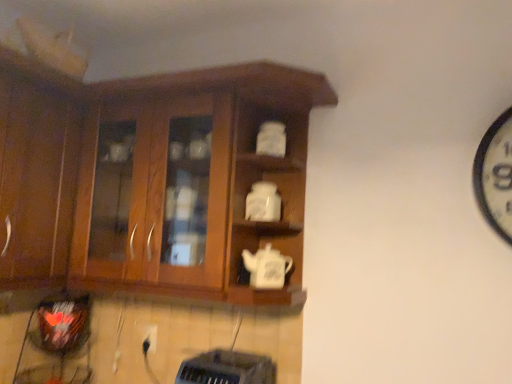
Question: Is white plastic electric outlet at lower center beside white matte teapot at center, the 2th teapot when ordered from top to bottom?

Choices:
 (A) no
 (B) yes

Answer: (A)

Question: From a real-world perspective, is white plastic electric outlet at lower center physically above white matte teapot at center, the 2th teapot when ordered from top to bottom?

Choices:
 (A) no
 (B) yes

Answer: (A)

Question: From the image's perspective, is white plastic electric outlet at lower center beneath white matte teapot at center, the 2th teapot when ordered from top to bottom?

Choices:
 (A) no
 (B) yes

Answer: (B)

Question: Does white plastic electric outlet at lower center come behind white matte teapot at center, the 1th teapot from the bottom?

Choices:
 (A) no
 (B) yes

Answer: (B)

Question: Is white plastic electric outlet at lower center oriented towards white matte teapot at center, the 1th teapot from the bottom?

Choices:
 (A) yes
 (B) no

Answer: (B)

Question: From the image's perspective, is white plastic electric outlet at lower center located above white matte teapot at center, the 1th teapot from the bottom?

Choices:
 (A) no
 (B) yes

Answer: (A)

Question: Are wooden cabinet at left, arranged as the second cabinetry when viewed from the right, and white matte teapot at center, placed as the 1th teapot when sorted from top to bottom, far apart?

Choices:
 (A) yes
 (B) no

Answer: (B)

Question: Is the depth of wooden cabinet at left, which appears as the first cabinetry when viewed from the left, less than that of white matte teapot at center, the 2th teapot ordered from the bottom?

Choices:
 (A) yes
 (B) no

Answer: (A)

Question: Is wooden cabinet at left, which appears as the first cabinetry when viewed from the left, positioned with its back to white matte teapot at center, placed as the 1th teapot when sorted from top to bottom?

Choices:
 (A) no
 (B) yes

Answer: (A)

Question: Does wooden cabinet at left, arranged as the second cabinetry when viewed from the right, turn towards white matte teapot at center, the 2th teapot ordered from the bottom?

Choices:
 (A) no
 (B) yes

Answer: (B)

Question: From a real-world perspective, is wooden cabinet at left, arranged as the second cabinetry when viewed from the right, physically below white matte teapot at center, placed as the 1th teapot when sorted from top to bottom?

Choices:
 (A) no
 (B) yes

Answer: (A)

Question: Is wooden cabinet at left, arranged as the second cabinetry when viewed from the right, to the left of white matte teapot at center, placed as the 1th teapot when sorted from top to bottom, from the viewer's perspective?

Choices:
 (A) no
 (B) yes

Answer: (B)

Question: Is wooden cabinet at left, arranged as the second cabinetry when viewed from the right, facing away from white matte teapot at center, the 2th teapot when ordered from top to bottom?

Choices:
 (A) no
 (B) yes

Answer: (A)